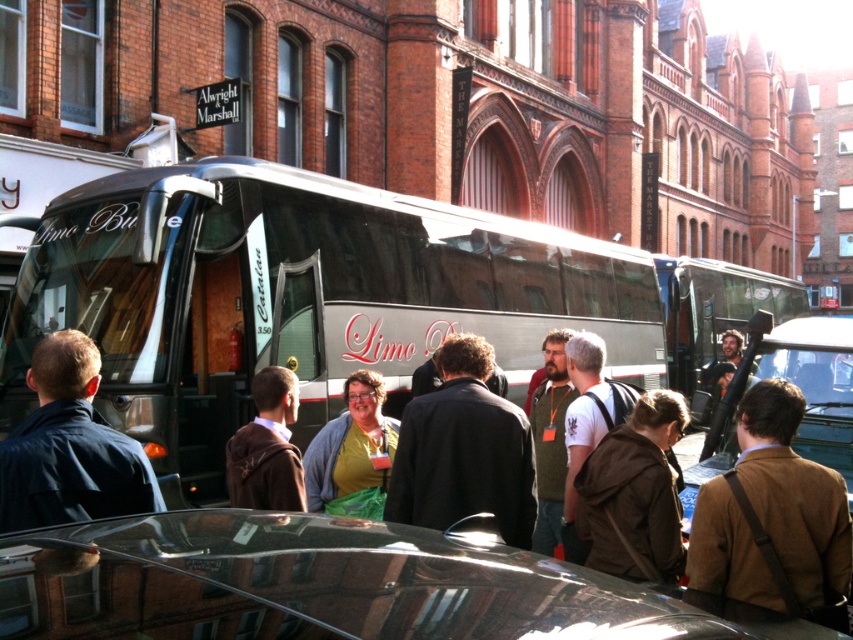
Is shiny silver bus at center thinner than dark blue jacket at left?

No, shiny silver bus at center is not thinner than dark blue jacket at left.

You are a GUI agent. You are given a task and a screenshot of the screen. Output one action in this format:
    pyautogui.click(x=<x>, y=<y>)
    Task: Click on the shiny silver bus at center
    
    Given the screenshot: What is the action you would take?
    pyautogui.click(x=296, y=298)

Locate an element on the screen. shiny silver bus at center is located at coordinates (296, 298).

Can you confirm if brown wool jacket at center is positioned to the left of white t-shirt with graphic at center?

Incorrect, brown wool jacket at center is not on the left side of white t-shirt with graphic at center.

Can you confirm if brown wool jacket at center is smaller than white t-shirt with graphic at center?

Yes, brown wool jacket at center is smaller than white t-shirt with graphic at center.

This screenshot has width=853, height=640. Identify the location of brown wool jacket at center. (773, 518).

Is brown wool jacket at center smaller than metallic silver bus at center?

Yes.

Between point (728, 548) and point (718, 262), which one is positioned behind?

The point (718, 262) is behind.

Locate an element on the screen. brown wool jacket at center is located at coordinates (773, 518).